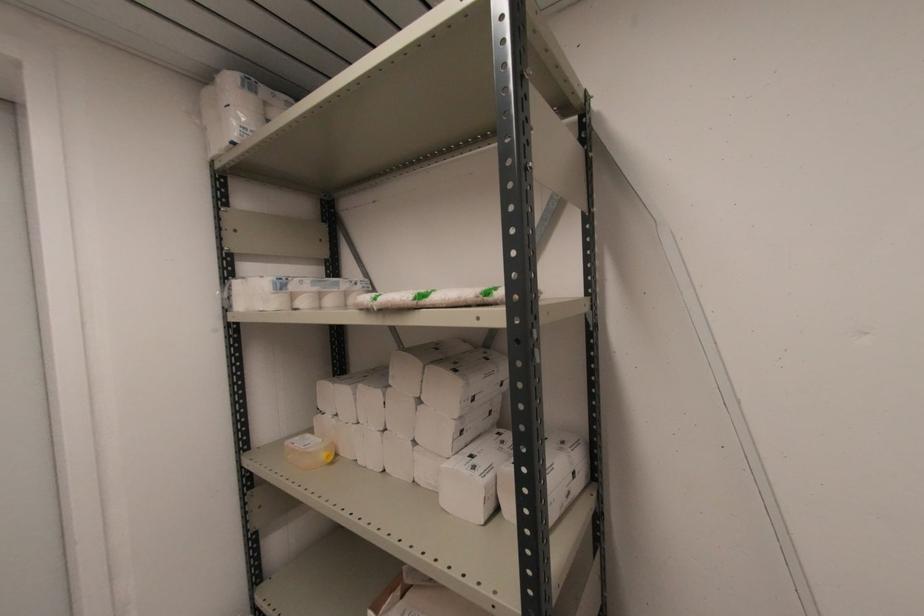
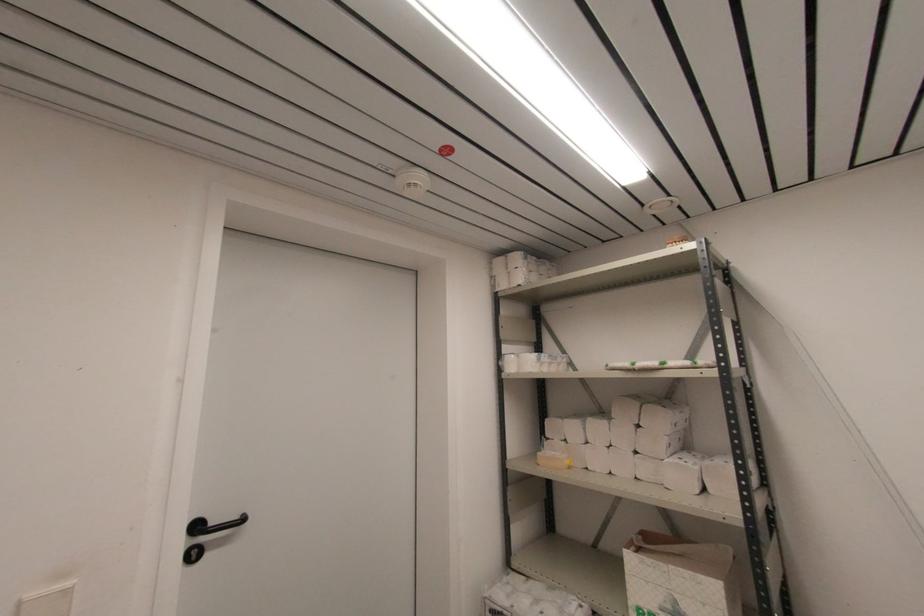
The point at (237, 134) is marked in the first image. Where is the corresponding point in the second image?

(524, 282)